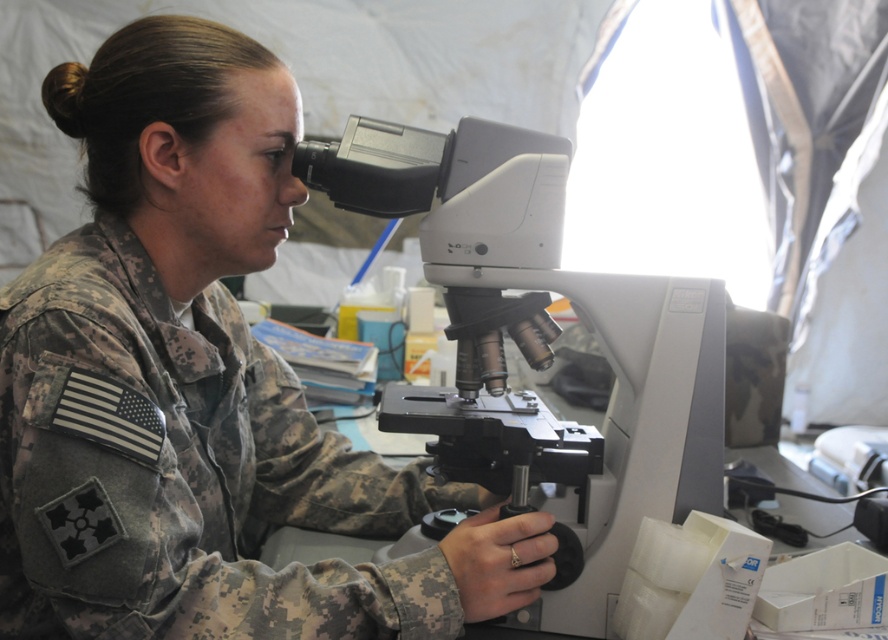
You are a photographer trying to capture a clear image of the white plastic microscope at center. However, the camouflage fabric uniform at center is blocking your view. Can you move the uniform to get an unobstructed shot of the microscope?

The camouflage fabric uniform at center is in front of the white plastic microscope at center, so moving the uniform would allow an unobstructed view of the microscope.

You are a field medic in a tent and need to access the white plastic microscope at center to examine a sample. However, your camouflage fabric uniform at center is blocking your view. Can you move the uniform to the side to access the microscope?

The camouflage fabric uniform at center is below the white plastic microscope at center, so you can move the uniform to the side to access the microscope since it is positioned underneath it.

You are a photographer trying to capture a clear image of the white plastic microscope at center in the tent. To avoid blocking the sunlight entering through the upper right opening, where should you position yourself relative to the camouflage fabric uniform at center?

You should position yourself to the right of the camouflage fabric uniform at center because the camouflage fabric uniform at center is to the left of the white plastic microscope at center, so standing to its right would keep you out of the sunlight coming from the upper right.